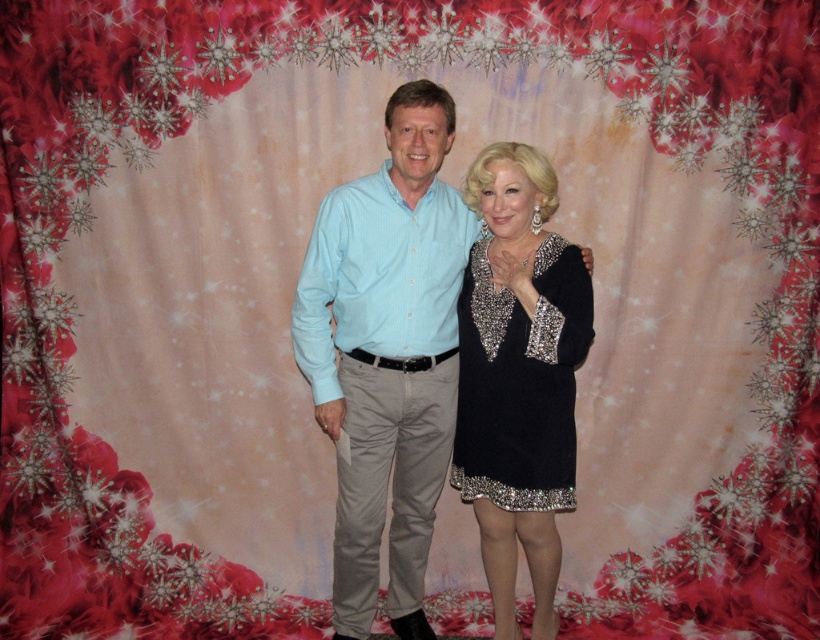
Can you confirm if light blue shirt at center is thinner than black sequined dress at center?

Incorrect, light blue shirt at center's width is not less than black sequined dress at center's.

Does point (399, 273) come farther from viewer compared to point (554, 282)?

Yes, point (399, 273) is farther from viewer.

The image size is (820, 640). What are the coordinates of `light blue shirt at center` in the screenshot? It's located at (386, 353).